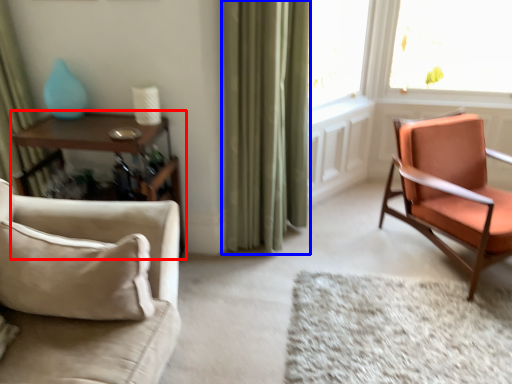
Question: Which point is closer to the camera, table (highlighted by a red box) or curtain (highlighted by a blue box)?

Choices:
 (A) table
 (B) curtain

Answer: (B)